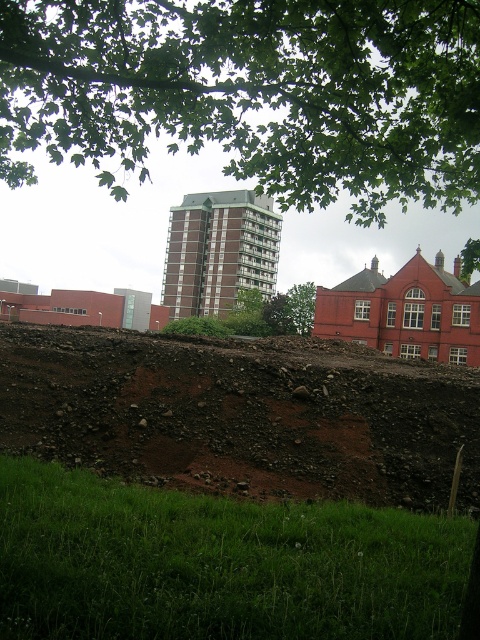
Question: Does green leafy tree at upper center appear on the left side of green leafy tree at center?

Choices:
 (A) yes
 (B) no

Answer: (A)

Question: Can you confirm if green leafy tree at upper center is wider than brown rocky dirt at lower center?

Choices:
 (A) no
 (B) yes

Answer: (B)

Question: Which object appears closest to the camera in this image?

Choices:
 (A) brown rocky dirt at lower center
 (B) green leafy tree at upper center

Answer: (B)

Question: Estimate the real-world distances between objects in this image. Which object is closer to the green leafy tree at upper center?

Choices:
 (A) brown rocky dirt at lower center
 (B) green leafy tree at center

Answer: (A)

Question: Is green leafy tree at upper center above green leafy tree at center?

Choices:
 (A) no
 (B) yes

Answer: (B)

Question: Which point is closer to the camera?

Choices:
 (A) brown rocky dirt at lower center
 (B) green leafy tree at upper center

Answer: (B)